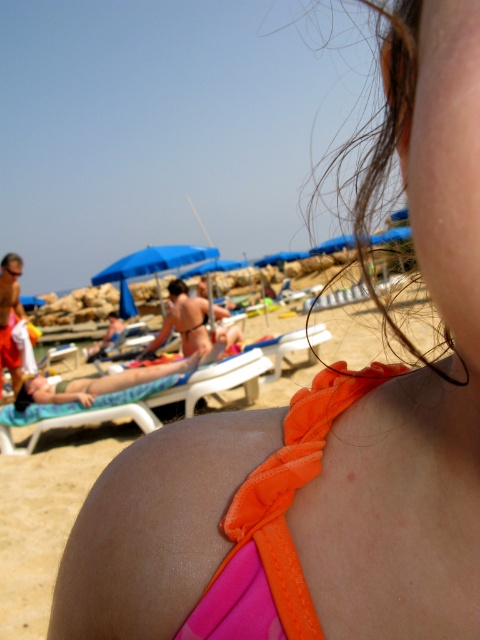
Question: Which point is closer to the camera taking this photo?

Choices:
 (A) (126, 410)
 (B) (228, 522)

Answer: (B)

Question: Is orange fabric bikini top at upper center closer to camera compared to green plastic beach chair at lower left?

Choices:
 (A) no
 (B) yes

Answer: (B)

Question: In this image, where is orange fabric bikini top at upper center located relative to green plastic beach chair at lower left?

Choices:
 (A) below
 (B) above

Answer: (B)

Question: Is orange fabric bikini top at upper center further to camera compared to green plastic beach chair at lower left?

Choices:
 (A) no
 (B) yes

Answer: (A)